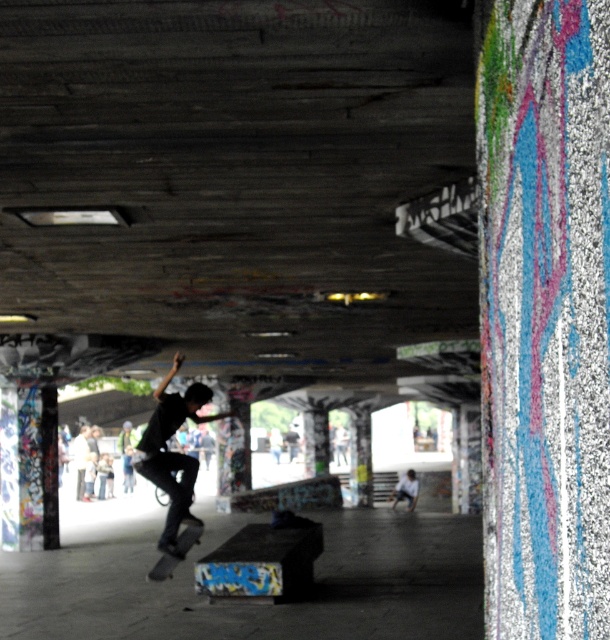
Question: Does black matte skateboarder at center lie in front of black matte skateboard at lower center?

Choices:
 (A) no
 (B) yes

Answer: (B)

Question: Does black matte skateboarder at center appear over black matte skateboard at lower center?

Choices:
 (A) no
 (B) yes

Answer: (B)

Question: Which point appears farthest from the camera in this image?

Choices:
 (A) (198, 541)
 (B) (160, 404)

Answer: (A)

Question: Does black matte skateboarder at center come behind black matte skateboard at lower center?

Choices:
 (A) yes
 (B) no

Answer: (B)